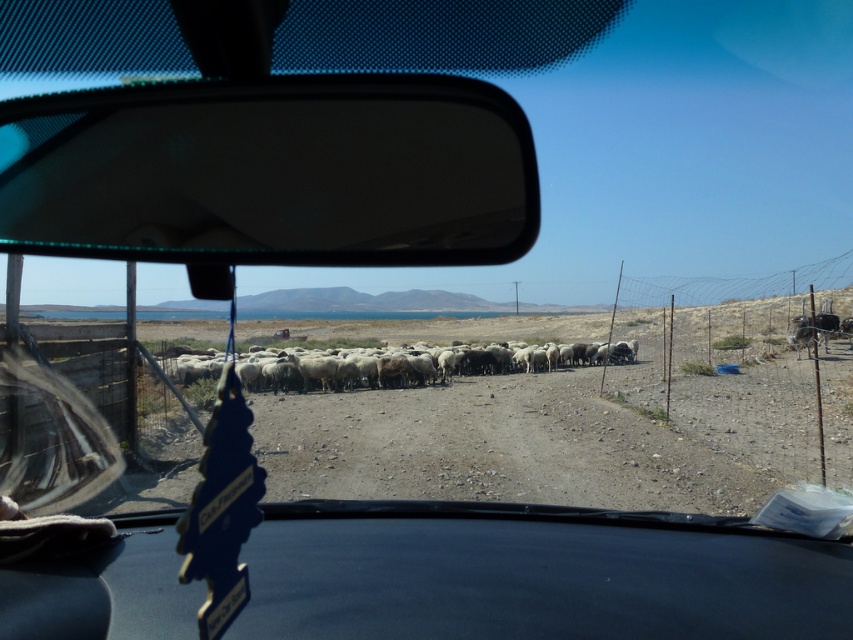
Is point (70, 253) behind point (195, 374)?

No, (70, 253) is in front of (195, 374).

How far apart are transparent plastic view mirror at upper center and white woolly sheep at center?

transparent plastic view mirror at upper center is 16.77 meters from white woolly sheep at center.

What are the coordinates of `transparent plastic view mirror at upper center` in the screenshot? It's located at point(271,172).

You are a GUI agent. You are given a task and a screenshot of the screen. Output one action in this format:
    pyautogui.click(x=<x>, y=<y>)
    Task: Click on the transparent plastic view mirror at upper center
    
    Given the screenshot: What is the action you would take?
    pyautogui.click(x=271, y=172)

Between black leather dashboard at center and white woolly sheep at center, which one has less height?

Standing shorter between the two is black leather dashboard at center.

Based on the photo, can you confirm if black leather dashboard at center is positioned to the left of white woolly sheep at center?

No, black leather dashboard at center is not to the left of white woolly sheep at center.

Who is more distant from viewer, (532, 522) or (210, 371)?

The point (210, 371) is behind.

The image size is (853, 640). I want to click on black leather dashboard at center, so click(532, 573).

Does transparent plastic view mirror at upper center appear over black leather dashboard at center?

Yes, transparent plastic view mirror at upper center is above black leather dashboard at center.

Can you confirm if transparent plastic view mirror at upper center is positioned to the right of black leather dashboard at center?

In fact, transparent plastic view mirror at upper center is to the left of black leather dashboard at center.

Find the location of `transparent plastic view mirror at upper center`. transparent plastic view mirror at upper center is located at coordinates (271, 172).

At what (x,y) coordinates should I click in order to perform the action: click on transparent plastic view mirror at upper center. Please return your answer as a coordinate pair (x, y). The height and width of the screenshot is (640, 853). Looking at the image, I should click on 271,172.